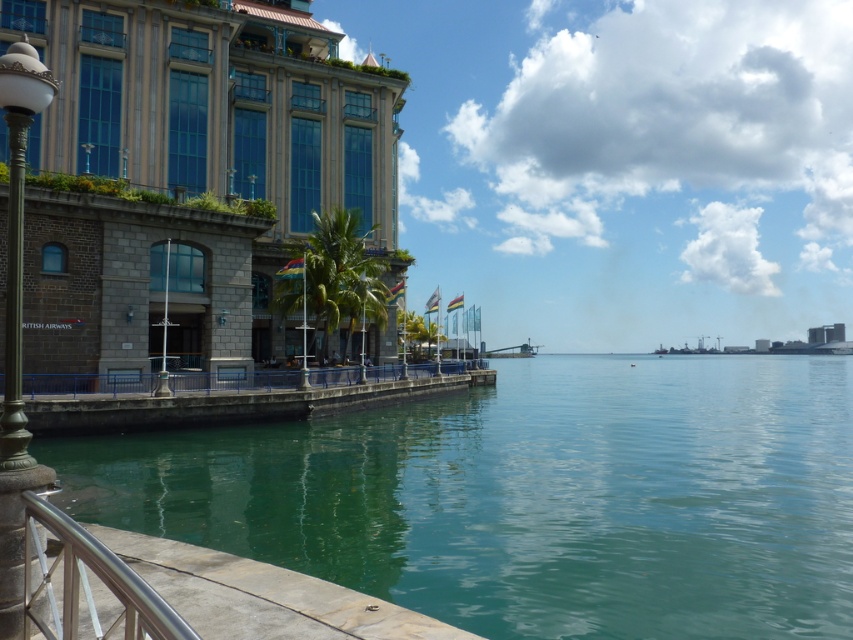
You are a delivery drone operator. Your drone needs to fly from the location of the satin silver railing at lower left to deliver a package to the green translucent water at center. What is the minimum distance the drone must travel?

The minimum distance the drone must travel is 38.13 meters, as the green translucent water at center is 38.13 meters away from the satin silver railing at lower left.

You are a photographer setting up equipment on the waterfront walkway. You need to position your tripod between the satin silver railing at lower left and the bronze textured lamp post at left. Given that the railing is larger than the lamp post, which object should you place your tripod closer to for stability?

The tripod should be placed closer to the bronze textured lamp post at left because the satin silver railing at lower left has a larger size and might obstruct the setup.